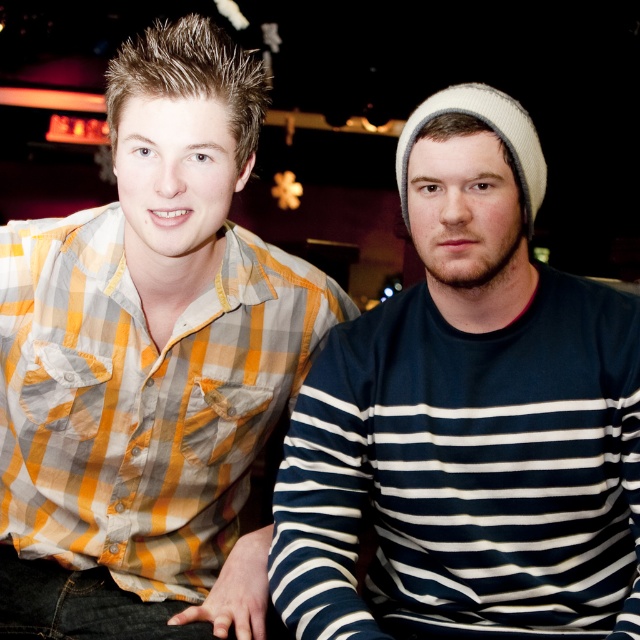
Question: Which object appears farthest from the camera in this image?

Choices:
 (A) dark blue striped sweater at right
 (B) yellow-orange plaid shirt at left

Answer: (B)

Question: Can you confirm if yellow-orange plaid shirt at left is bigger than dark blue striped sweater at right?

Choices:
 (A) yes
 (B) no

Answer: (A)

Question: Which of the following is the farthest from the observer?

Choices:
 (A) (182, 32)
 (B) (550, 480)

Answer: (A)

Question: Among these points, which one is nearest to the camera?

Choices:
 (A) (205, 330)
 (B) (554, 369)

Answer: (B)

Question: Is yellow-orange plaid shirt at left above dark blue striped sweater at right?

Choices:
 (A) no
 (B) yes

Answer: (B)

Question: Is yellow-orange plaid shirt at left smaller than dark blue striped sweater at right?

Choices:
 (A) yes
 (B) no

Answer: (B)